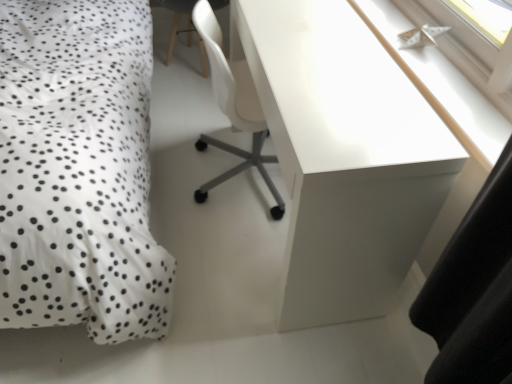
Describe the element at coordinates (177, 20) in the screenshot. I see `white plastic chair at center` at that location.

Describe the element at coordinates (441, 85) in the screenshot. I see `white glossy paper boat at upper right` at that location.

Where is `white dotted fabric at left`? The image size is (512, 384). white dotted fabric at left is located at coordinates pos(78,171).

This screenshot has width=512, height=384. In order to click on white glossy desk at upper right in this screenshot , I will do `click(344, 156)`.

Which object is more forward, white dotted fabric at left or white plastic chair at center?

Positioned in front is white dotted fabric at left.

Considering the sizes of objects white dotted fabric at left and white plastic chair at center in the image provided, who is thinner, white dotted fabric at left or white plastic chair at center?

white plastic chair at center is thinner.

Is white dotted fabric at left turned away from white plastic chair at center?

No, white dotted fabric at left's orientation is not away from white plastic chair at center.

Considering the relative positions of white dotted fabric at left and white plastic chair at center in the image provided, is white dotted fabric at left to the right of white plastic chair at center from the viewer's perspective?

In fact, white dotted fabric at left is to the left of white plastic chair at center.

From the image's perspective, is white glossy desk at upper right beneath white plastic chair at center?

Correct, white glossy desk at upper right appears lower than white plastic chair at center in the image.

Considering the relative sizes of white glossy desk at upper right and white plastic chair at center in the image provided, is white glossy desk at upper right thinner than white plastic chair at center?

Correct, the width of white glossy desk at upper right is less than that of white plastic chair at center.

Do you think white glossy desk at upper right is within white plastic chair at center, or outside of it?

The correct answer is: outside.

From a real-world perspective, who is located lower, white plastic chair at center or white dotted fabric at left?

white plastic chair at center.

How much distance is there between white plastic chair at center and white dotted fabric at left?

white plastic chair at center and white dotted fabric at left are 3.70 feet apart from each other.

From the image's perspective, is white plastic chair at center located above or below white dotted fabric at left?

white plastic chair at center is above white dotted fabric at left.

Which object is thinner, white glossy desk at upper right or white dotted fabric at left?

white glossy desk at upper right is thinner.

At what (x,y) coordinates should I click in order to perform the action: click on desk on the right of white dotted fabric at left. Please return your answer as a coordinate pair (x, y). The height and width of the screenshot is (384, 512). Looking at the image, I should click on (344, 156).

Does point (352, 143) lie behind point (17, 258)?

No, it is not.

Based on the photo, can you confirm if white glossy desk at upper right is positioned to the left of white dotted fabric at left?

No.

Looking at this image, from a real-world perspective, which is physically below, white plastic chair at center or white glossy paper boat at upper right?

white plastic chair at center, from a real-world perspective.

Is white plastic chair at center located outside white glossy paper boat at upper right?

Indeed, white plastic chair at center is completely outside white glossy paper boat at upper right.

Is white plastic chair at center facing towards white glossy paper boat at upper right?

Yes.

Which object is further away from the camera, white glossy paper boat at upper right or white glossy desk at upper right?

white glossy paper boat at upper right is behind.

Is white glossy paper boat at upper right next to white glossy desk at upper right?

No.

In the image, is white glossy paper boat at upper right on the left side or the right side of white glossy desk at upper right?

Based on their positions, white glossy paper boat at upper right is located to the right of white glossy desk at upper right.

Could you tell me if white glossy paper boat at upper right is turned towards white glossy desk at upper right?

Yes, white glossy paper boat at upper right is turned towards white glossy desk at upper right.

Is white dotted fabric at left facing towards white glossy paper boat at upper right?

No.

Can you see white dotted fabric at left touching white glossy paper boat at upper right?

No.

Who is smaller, white dotted fabric at left or white glossy paper boat at upper right?

With smaller size is white glossy paper boat at upper right.

From the image's perspective, is white dotted fabric at left beneath white glossy paper boat at upper right?

Actually, white dotted fabric at left appears above white glossy paper boat at upper right in the image.

This screenshot has height=384, width=512. Find the location of `computer chair on the right of white dotted fabric at left`. computer chair on the right of white dotted fabric at left is located at coordinates (177, 20).

This screenshot has width=512, height=384. Identify the location of desk in front of the white plastic chair at center. (344, 156).

Considering their positions, is white glossy desk at upper right positioned closer to white plastic chair at center than white glossy paper boat at upper right?

Among the two, white glossy paper boat at upper right is located nearer to white plastic chair at center.

Looking at the image, which one is located further to white plastic chair at center, white glossy paper boat at upper right or white glossy desk at upper right?

The object further to white plastic chair at center is white glossy desk at upper right.

Estimate the real-world distances between objects in this image. Which object is closer to white glossy desk at upper right, white plastic chair at center or white glossy paper boat at upper right?

white glossy paper boat at upper right.

Which object lies further to the anchor point white plastic chair at center, white glossy desk at upper right or white dotted fabric at left?

Among the two, white glossy desk at upper right is located further to white plastic chair at center.

When comparing their distances from white glossy paper boat at upper right, does white glossy desk at upper right or white plastic chair at center seem closer?

white glossy desk at upper right is closer to white glossy paper boat at upper right.

Based on their spatial positions, is white glossy desk at upper right or white glossy paper boat at upper right further from white dotted fabric at left?

A: white glossy paper boat at upper right is positioned further to the anchor white dotted fabric at left.

When comparing their distances from white glossy desk at upper right, does white plastic chair at center or white dotted fabric at left seem closer?

white dotted fabric at left lies closer to white glossy desk at upper right than the other object.

Which object lies nearer to the anchor point white glossy paper boat at upper right, white plastic chair at center or white dotted fabric at left?

white dotted fabric at left is closer to white glossy paper boat at upper right.

Find the location of a particular element. window sill between white glossy desk at upper right and white plastic chair at center along the z-axis is located at coordinates (441, 85).

Locate an element on the screen. window sill between white dotted fabric at left and white plastic chair at center in the front-back direction is located at coordinates pyautogui.click(x=441, y=85).

Find the location of a particular element. desk between white dotted fabric at left and white plastic chair at center in the front-back direction is located at coordinates (344, 156).

Locate an element on the screen. desk between white dotted fabric at left and white glossy paper boat at upper right from left to right is located at coordinates (344, 156).